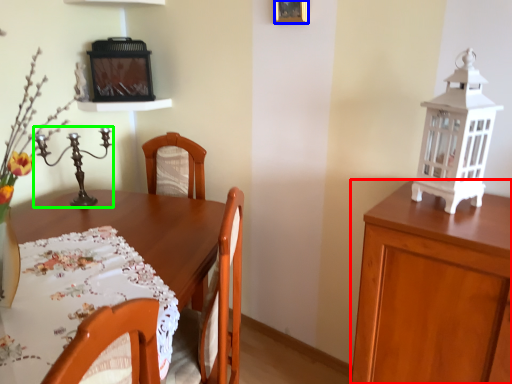
Question: Which object is the farthest from cabinetry (highlighted by a red box)? Choose among these: picture frame (highlighted by a blue box) or candle holder (highlighted by a green box).

Choices:
 (A) picture frame
 (B) candle holder

Answer: (B)